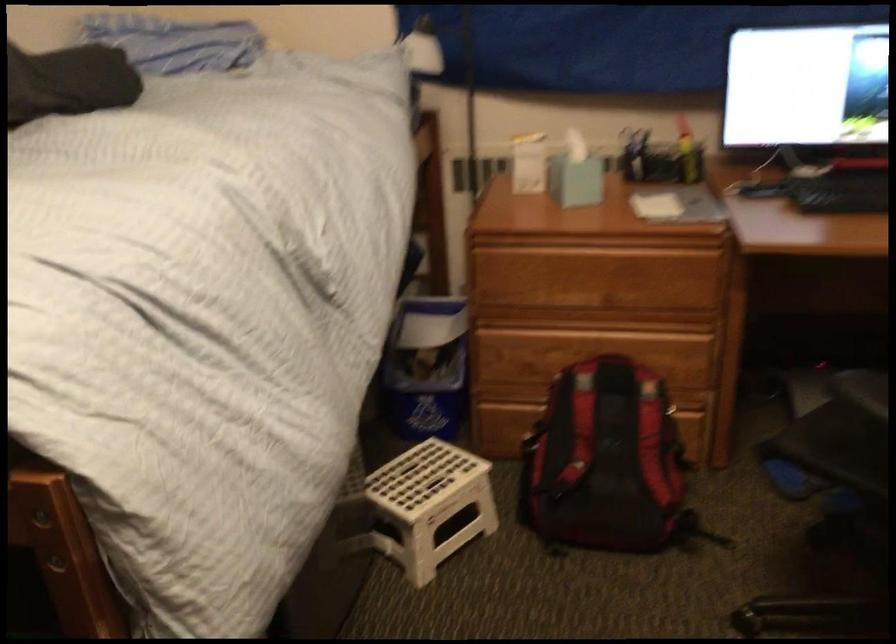
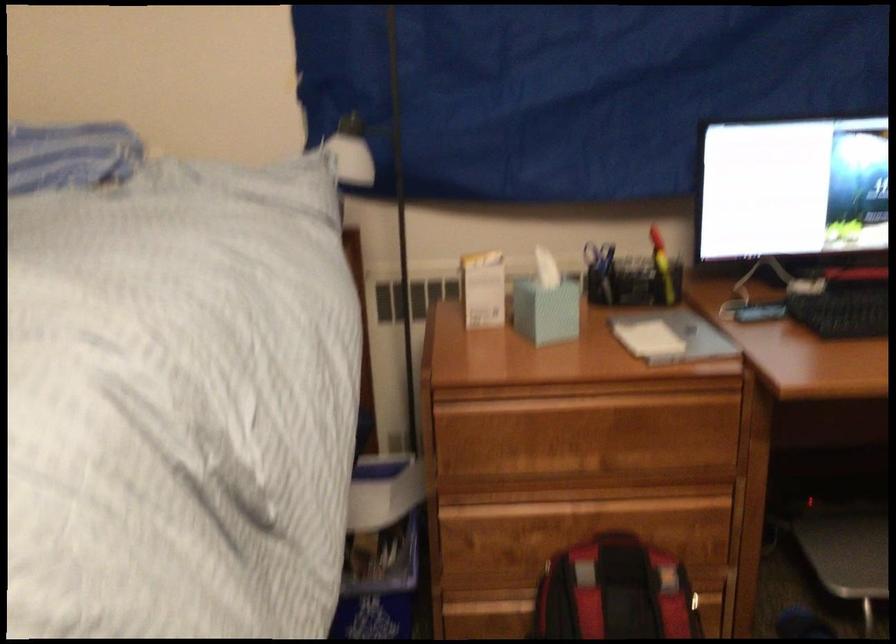
Locate, in the second image, the point that corresponds to [690,149] in the first image.

(662, 267)